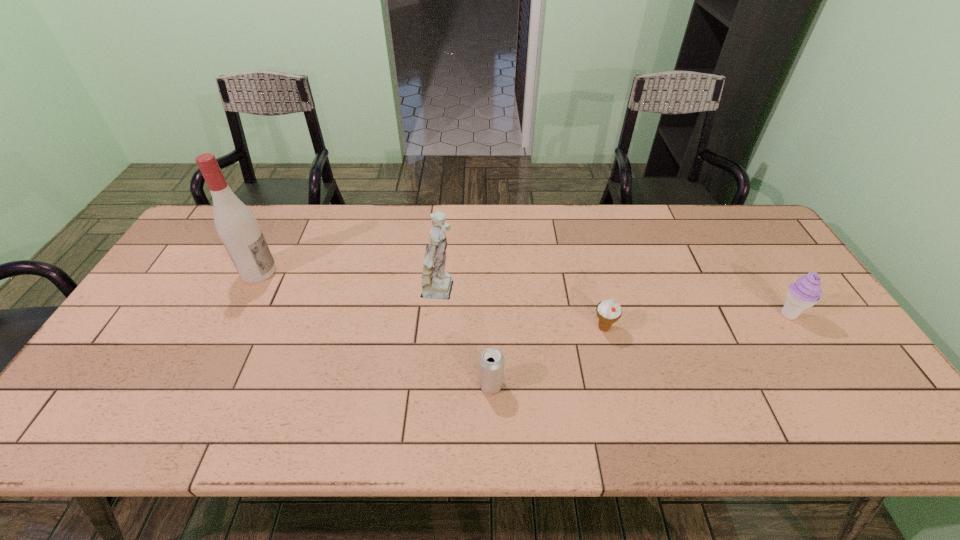
Locate an element on the screen. Image resolution: width=960 pixels, height=540 pixels. vacant position located on the label of the alcohol is located at coordinates (383, 272).

This screenshot has height=540, width=960. Find the location of `vacant position located 0.300m on the front-facing side of the figurine`. vacant position located 0.300m on the front-facing side of the figurine is located at coordinates (567, 293).

You are a GUI agent. You are given a task and a screenshot of the screen. Output one action in this format:
    pyautogui.click(x=<x>, y=<y>)
    Task: Click on the free spot located on the front of the rightmost object
    The width and height of the screenshot is (960, 540).
    Given the screenshot: What is the action you would take?
    pyautogui.click(x=837, y=392)

I want to click on free space located 0.050m on the front of the fourth object from left to right, so click(611, 353).

You are a GUI agent. You are given a task and a screenshot of the screen. Output one action in this format:
    pyautogui.click(x=<x>, y=<y>)
    Task: Click on the blank area located 0.330m on the left of the third object from left to right
    The width and height of the screenshot is (960, 540).
    Given the screenshot: What is the action you would take?
    pyautogui.click(x=340, y=384)

Locate an element on the screen. Image resolution: width=960 pixels, height=540 pixels. object that is positioned at the right edge is located at coordinates (806, 291).

Image resolution: width=960 pixels, height=540 pixels. In the image, there is a desktop. Identify the location of free space at the far edge. (712, 239).

Locate an element on the screen. free location at the near edge of the desktop is located at coordinates (345, 429).

Locate an element on the screen. The image size is (960, 540). vacant space at the left edge of the desktop is located at coordinates (141, 313).

Locate an element on the screen. The height and width of the screenshot is (540, 960). free space at the near left corner is located at coordinates (76, 410).